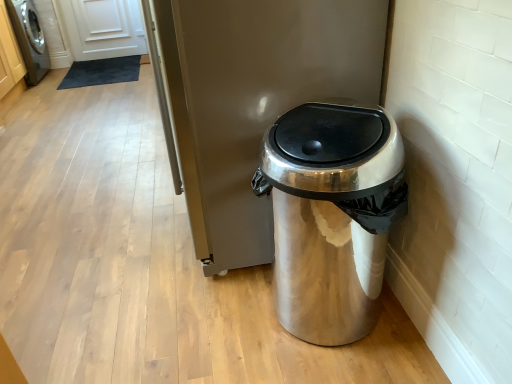
Question: Is satin silver trash can at center facing away from shiny metallic trash can at lower right?

Choices:
 (A) no
 (B) yes

Answer: (A)

Question: Considering the relative sizes of satin silver trash can at center and shiny metallic trash can at lower right in the image provided, is satin silver trash can at center smaller than shiny metallic trash can at lower right?

Choices:
 (A) yes
 (B) no

Answer: (B)

Question: Is satin silver trash can at center oriented towards shiny metallic trash can at lower right?

Choices:
 (A) no
 (B) yes

Answer: (A)

Question: Can you confirm if satin silver trash can at center is thinner than shiny metallic trash can at lower right?

Choices:
 (A) yes
 (B) no

Answer: (B)

Question: Does satin silver trash can at center have a greater width compared to shiny metallic trash can at lower right?

Choices:
 (A) no
 (B) yes

Answer: (B)

Question: From the image's perspective, relative to satin silver trash can at center, is shiny metallic trash can at lower right above or below?

Choices:
 (A) above
 (B) below

Answer: (B)

Question: Considering the relative positions of shiny metallic trash can at lower right and satin silver trash can at center in the image provided, is shiny metallic trash can at lower right to the left or to the right of satin silver trash can at center?

Choices:
 (A) right
 (B) left

Answer: (A)

Question: Considering their positions, is shiny metallic trash can at lower right located in front of or behind satin silver trash can at center?

Choices:
 (A) front
 (B) behind

Answer: (A)

Question: Considering the positions of shiny metallic trash can at lower right and satin silver trash can at center in the image, is shiny metallic trash can at lower right taller or shorter than satin silver trash can at center?

Choices:
 (A) tall
 (B) short

Answer: (B)

Question: Considering the relative positions of satin silver trash can at center and brushed metal washing machine at left in the image provided, is satin silver trash can at center to the left or to the right of brushed metal washing machine at left?

Choices:
 (A) right
 (B) left

Answer: (A)

Question: Is satin silver trash can at center taller or shorter than brushed metal washing machine at left?

Choices:
 (A) tall
 (B) short

Answer: (A)

Question: From a real-world perspective, is satin silver trash can at center above or below brushed metal washing machine at left?

Choices:
 (A) above
 (B) below

Answer: (A)

Question: Does point (200, 77) appear closer or farther from the camera than point (27, 46)?

Choices:
 (A) closer
 (B) farther

Answer: (A)

Question: Visually, is shiny metallic trash can at lower right positioned to the left or to the right of brushed metal washing machine at left?

Choices:
 (A) right
 (B) left

Answer: (A)

Question: Considering the positions of point (283, 236) and point (37, 48), is point (283, 236) closer or farther from the camera than point (37, 48)?

Choices:
 (A) closer
 (B) farther

Answer: (A)